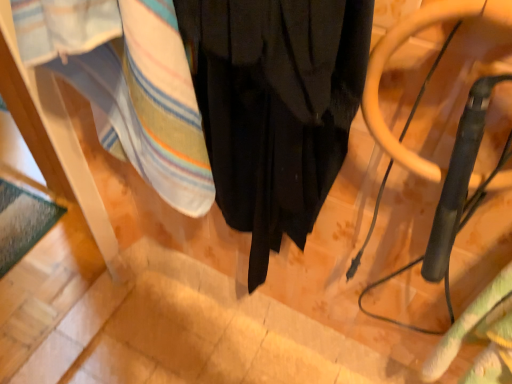
Question: In terms of size, does black matte curtain at center appear bigger or smaller than striped cotton towel at lower left, the second blanket viewed from the right?

Choices:
 (A) small
 (B) big

Answer: (A)

Question: Would you say black matte curtain at center is to the left or to the right of striped cotton towel at lower left, which is counted as the 2th blanket, starting from the bottom, in the picture?

Choices:
 (A) right
 (B) left

Answer: (A)

Question: Based on their relative distances, which object is farther from the black matte curtain at center?

Choices:
 (A) metallic gray swivel chair at right
 (B) green textured blanket at lower right, arranged as the 2th blanket when viewed from the left
 (C) striped cotton towel at lower left, the second blanket viewed from the right

Answer: (B)

Question: Considering the real-world distances, which object is farthest from the green textured blanket at lower right, the first blanket in the right-to-left sequence?

Choices:
 (A) black matte curtain at center
 (B) striped cotton towel at lower left, which is the 1th blanket from left to right
 (C) metallic gray swivel chair at right

Answer: (B)